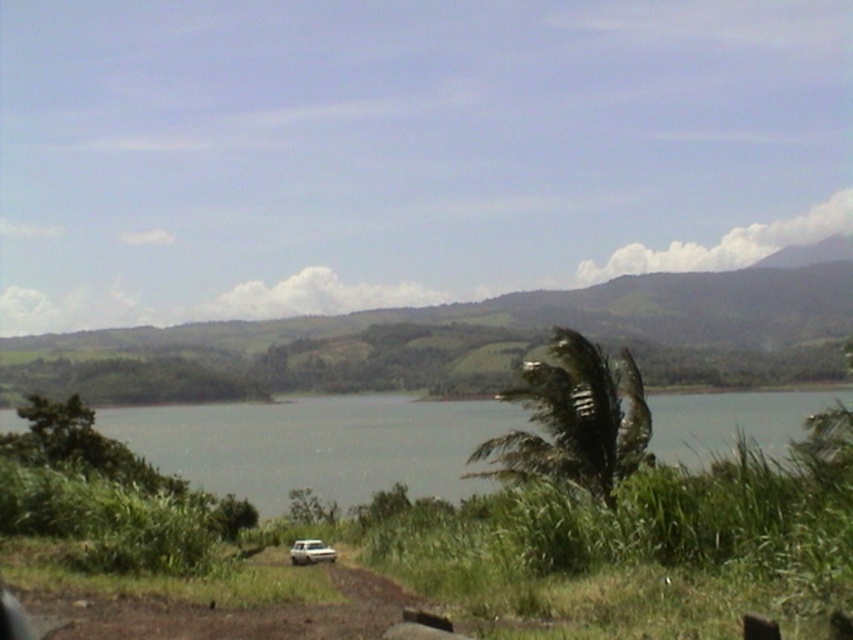
You are standing at the edge of the brown dirt track at lower center and want to climb up to the green grassy hill at center. Is the hill above or below your current position?

The green grassy hill at center is located above the brown dirt track at lower center, so the hill is above your current position.

You are standing at the point labeled as point (317, 444) in the image. Based on the scene description, what type of terrain or surface are you currently standing on?

The point (317, 444) corresponds to gray water at center, so you are standing on water.